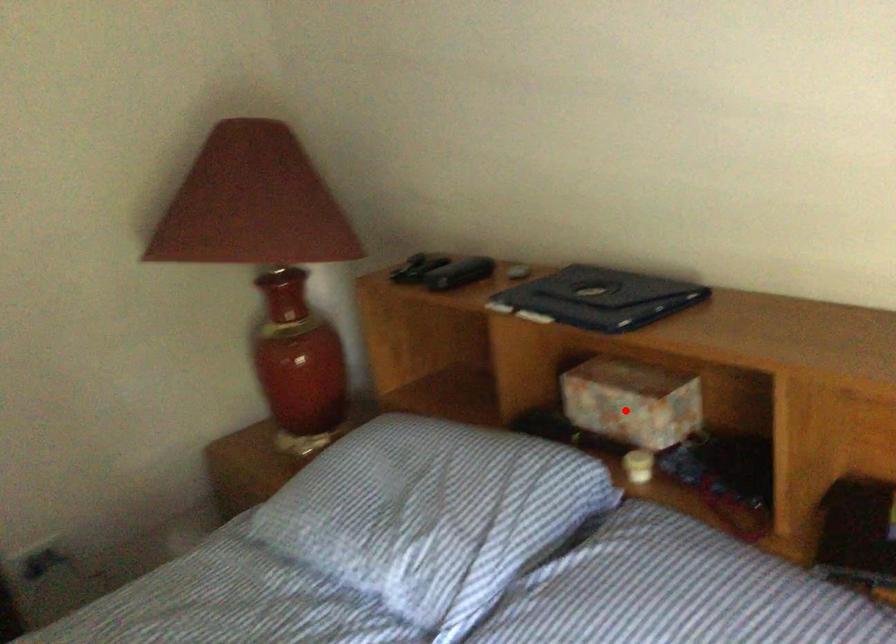
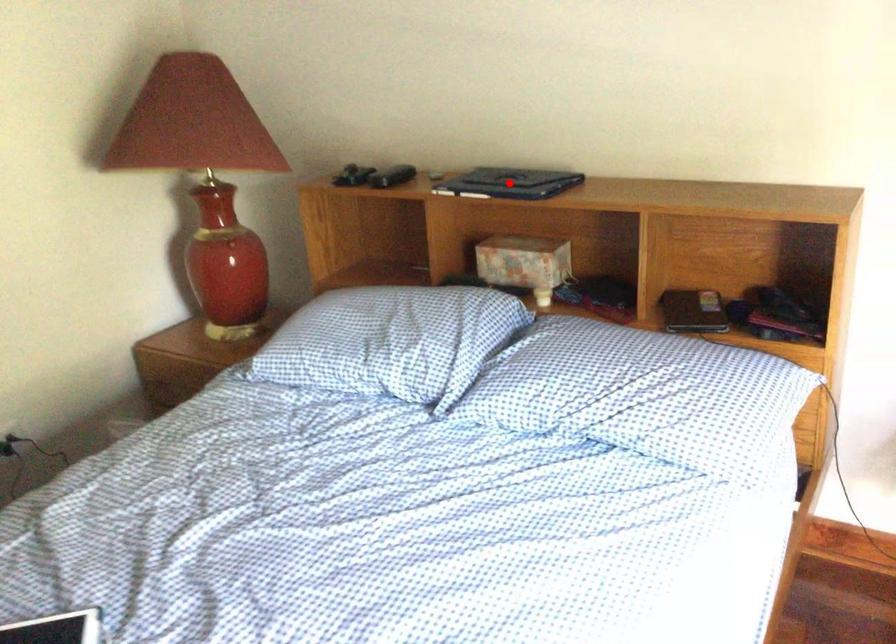
I am providing you with two images of the same scene from different viewpoints. A red point is marked on the first image and another point is marked on the second image. Does the point marked in image1 correspond to the same location as the one in image2?

No